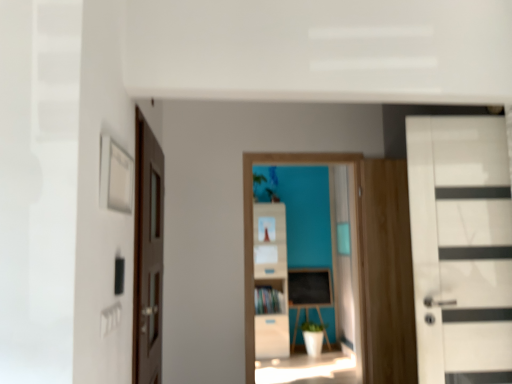
Question: Does wooden cabinet at center come behind white glossy door at right, the second door when ordered from left to right?

Choices:
 (A) no
 (B) yes

Answer: (B)

Question: Is wooden cabinet at center taller than white glossy door at right, placed as the 1th door when sorted from right to left?

Choices:
 (A) no
 (B) yes

Answer: (A)

Question: Would you consider wooden cabinet at center to be distant from white glossy door at right, the second door when ordered from left to right?

Choices:
 (A) no
 (B) yes

Answer: (B)

Question: Can you confirm if wooden cabinet at center is shorter than white glossy door at right, the second door when ordered from left to right?

Choices:
 (A) no
 (B) yes

Answer: (B)

Question: Would you say wooden cabinet at center is outside white glossy door at right, placed as the 1th door when sorted from right to left?

Choices:
 (A) yes
 (B) no

Answer: (A)

Question: Is wooden cabinet at center at the left side of white glossy door at right, placed as the 1th door when sorted from right to left?

Choices:
 (A) no
 (B) yes

Answer: (B)

Question: Is wooden cabinet at center a part of wooden file cabinet at center?

Choices:
 (A) yes
 (B) no

Answer: (A)

Question: Can you confirm if wooden file cabinet at center is smaller than wooden cabinet at center?

Choices:
 (A) yes
 (B) no

Answer: (B)

Question: Can you confirm if wooden file cabinet at center is positioned to the right of wooden cabinet at center?

Choices:
 (A) no
 (B) yes

Answer: (B)

Question: From a real-world perspective, is wooden file cabinet at center on top of wooden cabinet at center?

Choices:
 (A) no
 (B) yes

Answer: (B)

Question: From the image's perspective, is wooden file cabinet at center located beneath wooden cabinet at center?

Choices:
 (A) yes
 (B) no

Answer: (B)

Question: Is wooden file cabinet at center facing away from wooden cabinet at center?

Choices:
 (A) no
 (B) yes

Answer: (B)

Question: Is blackboard at center smaller than white glossy door at right, placed as the 1th door when sorted from right to left?

Choices:
 (A) no
 (B) yes

Answer: (B)